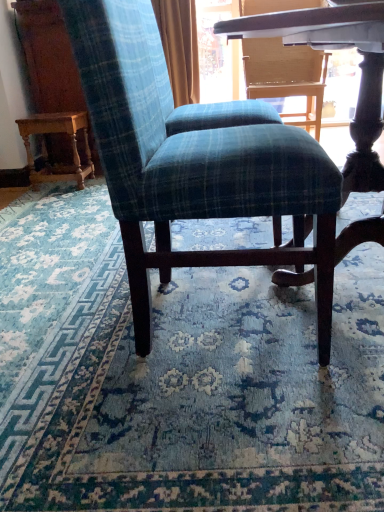
You are a GUI agent. You are given a task and a screenshot of the screen. Output one action in this format:
    pyautogui.click(x=<x>, y=<y>)
    Task: Click on the free spot above wooden carved table at left (from a real-world perspective)
    This screenshot has height=512, width=384.
    Given the screenshot: What is the action you would take?
    pyautogui.click(x=55, y=113)